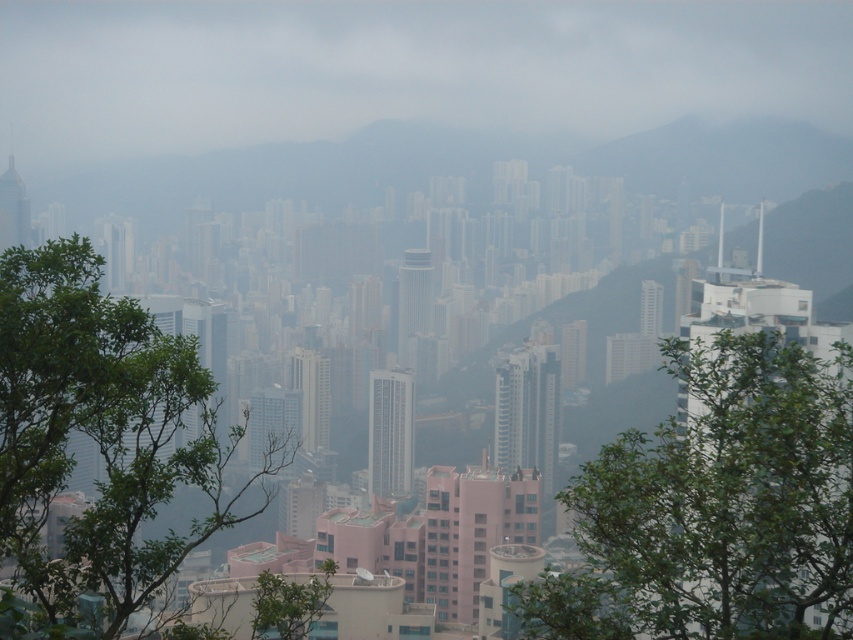
Between point (624, 445) and point (74, 572), which one is positioned in front?

Positioned in front is point (624, 445).

Is green leafy tree at center positioned at the back of green leafy tree at left?

Yes, it is.

You are a GUI agent. You are given a task and a screenshot of the screen. Output one action in this format:
    pyautogui.click(x=<x>, y=<y>)
    Task: Click on the green leafy tree at center
    The height and width of the screenshot is (640, 853).
    Given the screenshot: What is the action you would take?
    pyautogui.click(x=717, y=508)